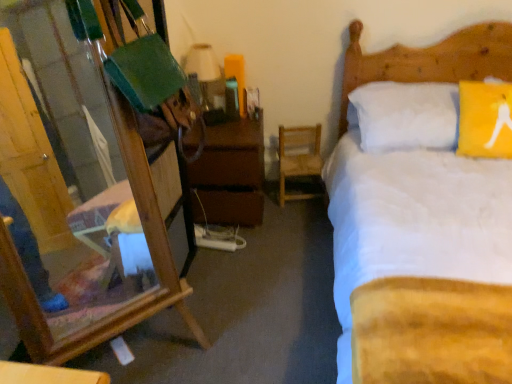
Question: Considering their positions, is white soft bed at upper right located in front of or behind wooden chair at center?

Choices:
 (A) front
 (B) behind

Answer: (A)

Question: Considering the relative positions of white soft bed at upper right and wooden chair at center in the image provided, is white soft bed at upper right to the left or to the right of wooden chair at center?

Choices:
 (A) right
 (B) left

Answer: (A)

Question: Which object is positioned farthest from the wooden chair at center?

Choices:
 (A) white soft bed at upper right
 (B) matte white lampshade at upper center
 (C) wooden mirror at left
 (D) brown wooden nightstand at center

Answer: (C)

Question: Based on their relative distances, which object is farther from the white soft bed at upper right?

Choices:
 (A) wooden mirror at left
 (B) brown wooden nightstand at center
 (C) wooden chair at center
 (D) matte white lampshade at upper center

Answer: (A)